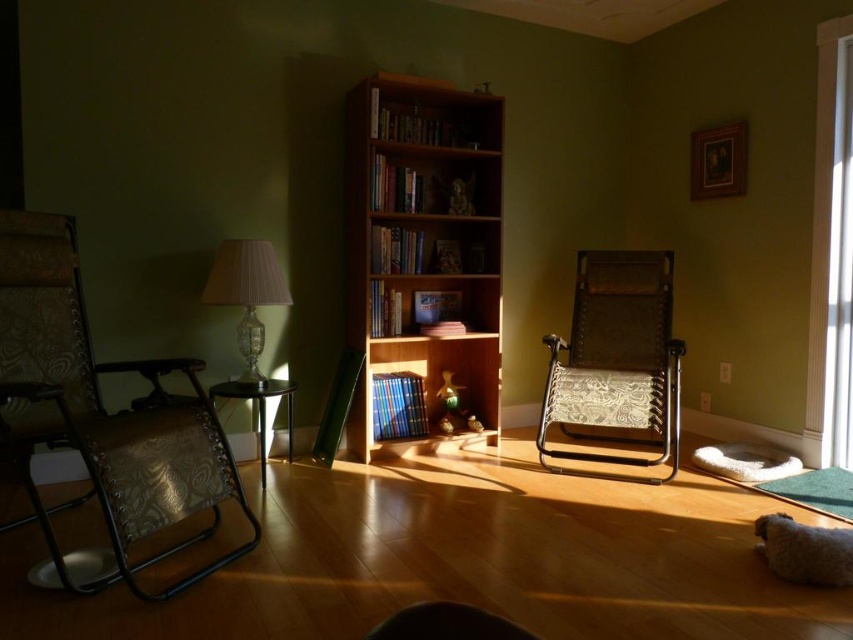
Which is in front, point (84, 589) or point (540, 429)?

Point (84, 589) is more forward.

Who is positioned more to the right, patterned fabric chair at left or patterned fabric chair at right?

Positioned to the right is patterned fabric chair at right.

The width and height of the screenshot is (853, 640). What are the coordinates of `patterned fabric chair at left` in the screenshot? It's located at (100, 413).

Is patterned fabric chair at left shorter than clear glass door at right?

Correct, patterned fabric chair at left is not as tall as clear glass door at right.

Which of these two, patterned fabric chair at left or clear glass door at right, stands shorter?

Standing shorter between the two is patterned fabric chair at left.

Is point (103, 480) closer to viewer compared to point (840, 81)?

That is True.

Locate an element on the screen. The height and width of the screenshot is (640, 853). patterned fabric chair at left is located at coordinates (100, 413).

Is light wood bookcase at center to the right of clear glass door at right from the viewer's perspective?

Incorrect, light wood bookcase at center is not on the right side of clear glass door at right.

Describe the element at coordinates (422, 244) in the screenshot. This screenshot has width=853, height=640. I see `light wood bookcase at center` at that location.

Where is `light wood bookcase at center`? The height and width of the screenshot is (640, 853). light wood bookcase at center is located at coordinates (422, 244).